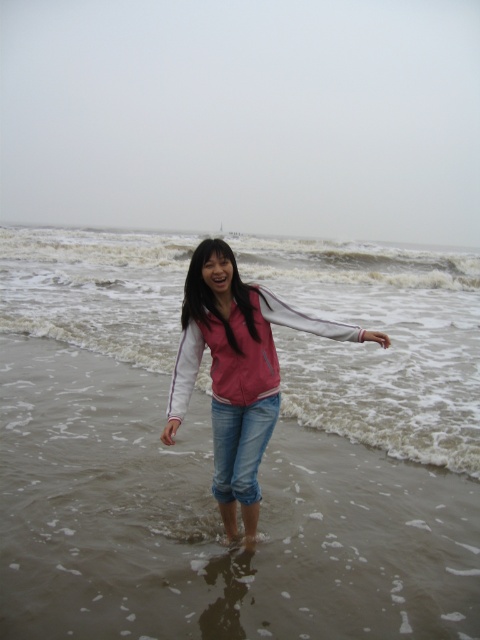
Question: Considering the relative positions of pink fabric jacket at center and denim jeans at center in the image provided, where is pink fabric jacket at center located with respect to denim jeans at center?

Choices:
 (A) above
 (B) below

Answer: (A)

Question: Which is farther from the denim jeans at center?

Choices:
 (A) white frothy wave at center
 (B) brown sandy water at center

Answer: (A)

Question: Which object is the closest to the denim jeans at center?

Choices:
 (A) white frothy wave at center
 (B) pink fabric jacket at center
 (C) brown sandy water at center

Answer: (B)

Question: Is pink fabric jacket at center further to camera compared to white frothy wave at center?

Choices:
 (A) yes
 (B) no

Answer: (B)

Question: Does pink fabric jacket at center have a larger size compared to denim jeans at center?

Choices:
 (A) no
 (B) yes

Answer: (B)

Question: Which is farther from the brown sandy water at center?

Choices:
 (A) denim jeans at center
 (B) pink fabric jacket at center
 (C) white frothy wave at center

Answer: (B)